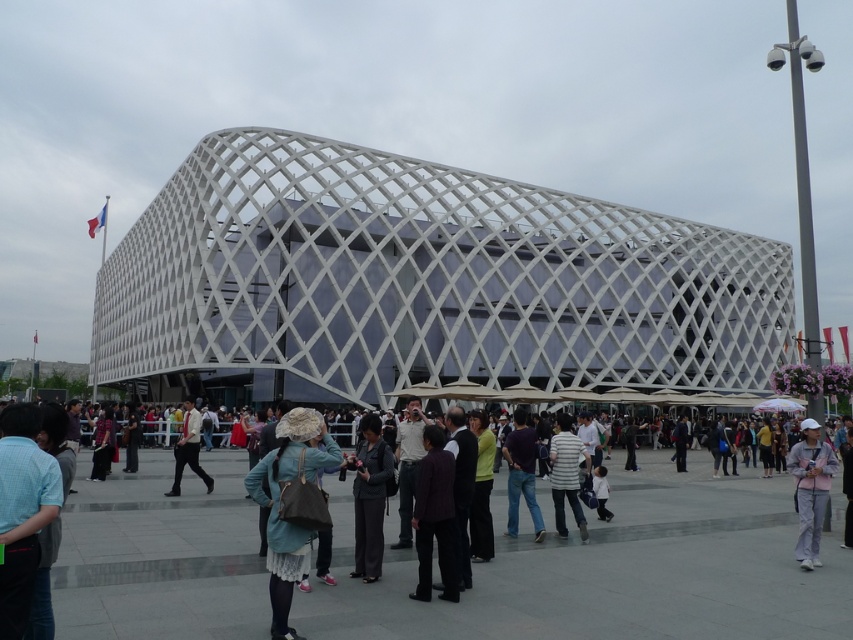
You are a photographer positioned in the plaza in front of the building. You notice two people wearing a striped cotton shirt at center and a light brown leather jacket at center. Which clothing item is higher on the person wearing it?

The striped cotton shirt at center is above the light brown leather jacket at center, so the striped cotton shirt at center is higher on the person wearing it.

You are a photographer standing in the plaza in front of the building. You want to capture a photo that includes both the dark purple fabric jacket at center and the striped cotton shirt at center. Which clothing item should you adjust your focus to ensure it appears more prominent in the foreground?

The dark purple fabric jacket at center is in front of the striped cotton shirt at center, so focusing on it will make it appear more prominent in the foreground.

You are standing in the plaza in front of the modern building. You want to reach a specific point marked at coordinates point (830, 449). Considering the plaza is 120 feet wide, can you walk directly to that point without crossing the building?

The point (830, 449) is 113.83 feet away from the viewer. Since the plaza is 120 feet wide, you can walk directly to the point without crossing the building as the distance is within the plaza width.